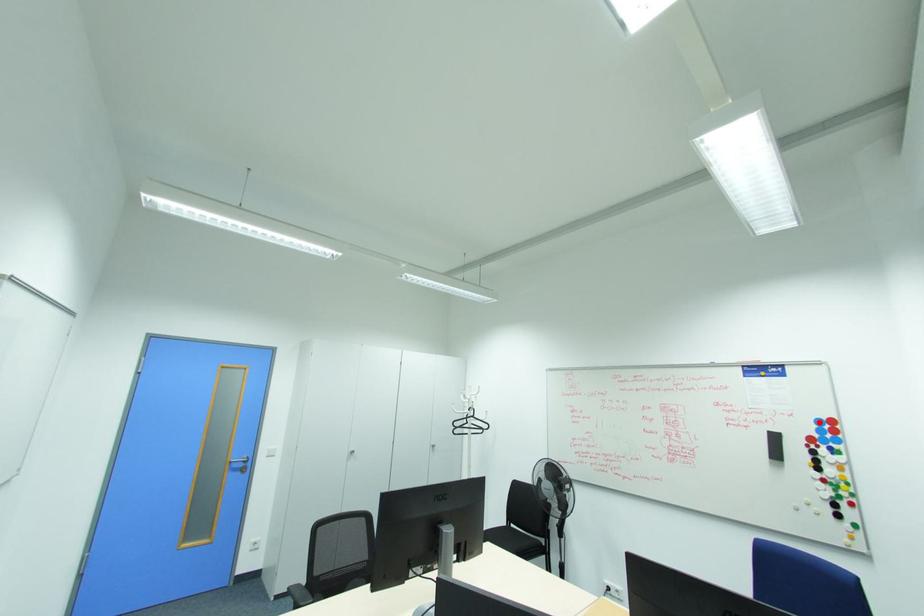
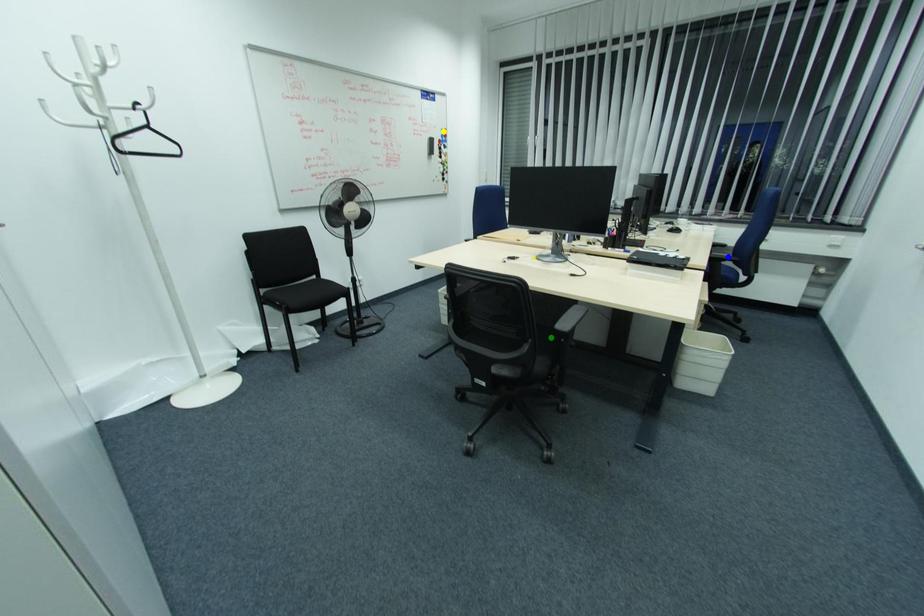
Question: I am providing you with two images of the same scene from different viewpoints. A red point is marked on the first image. You are given multiple points on the second image. In image 2, which mark is for the same physical point as the one in image 1?

Choices:
 (A) green point
 (B) yellow point
 (C) blue point

Answer: (B)